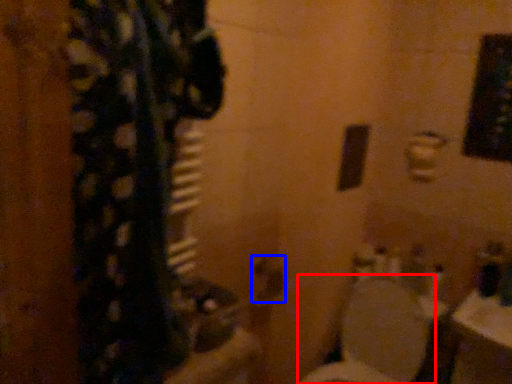
Question: Which object is closer to the camera taking this photo, toilet (highlighted by a red box) or door handle (highlighted by a blue box)?

Choices:
 (A) toilet
 (B) door handle

Answer: (A)